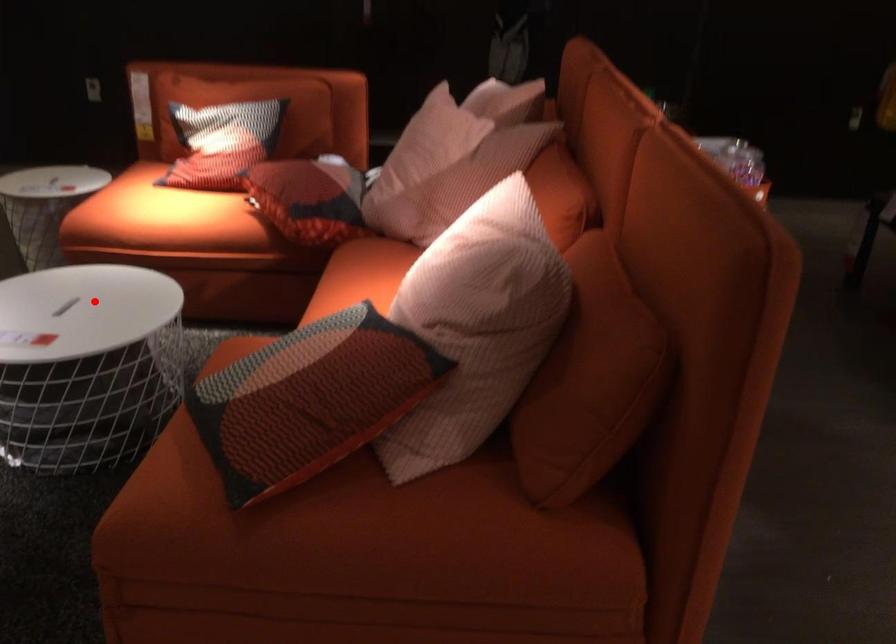
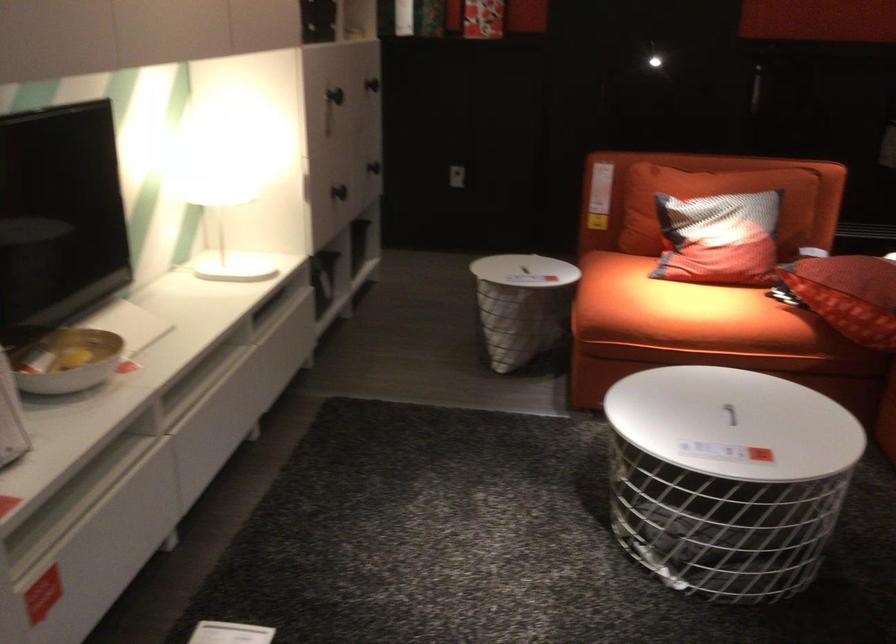
Locate, in the second image, the point that corresponds to the highlighted location in the first image.

(729, 413)